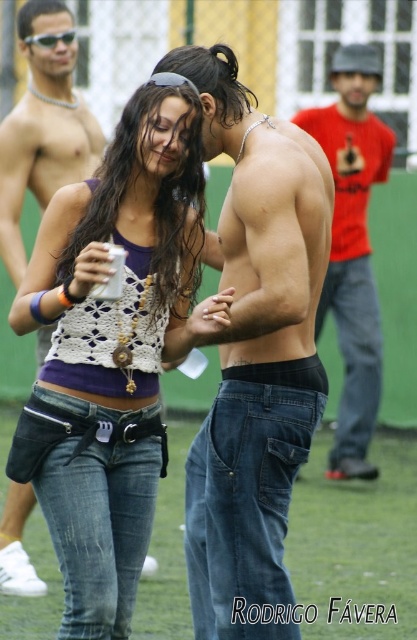
Question: Is matte red shirt at right below shiny black hair at upper center?

Choices:
 (A) yes
 (B) no

Answer: (A)

Question: Can you confirm if dark blue denim jeans at center is positioned above black elastic waistband at center?

Choices:
 (A) yes
 (B) no

Answer: (B)

Question: Which of the following is the farthest from the observer?

Choices:
 (A) (281, 557)
 (B) (108, 483)
 (C) (341, 266)

Answer: (C)

Question: Which point is farther to the camera?

Choices:
 (A) dark blue denim jeans at center
 (B) shiny black hair at upper center

Answer: (B)

Question: Which point is farther to the camera?

Choices:
 (A) (34, 184)
 (B) (205, 458)

Answer: (A)

Question: Is crochet tank top at center below denim jeans at center?

Choices:
 (A) yes
 (B) no

Answer: (B)